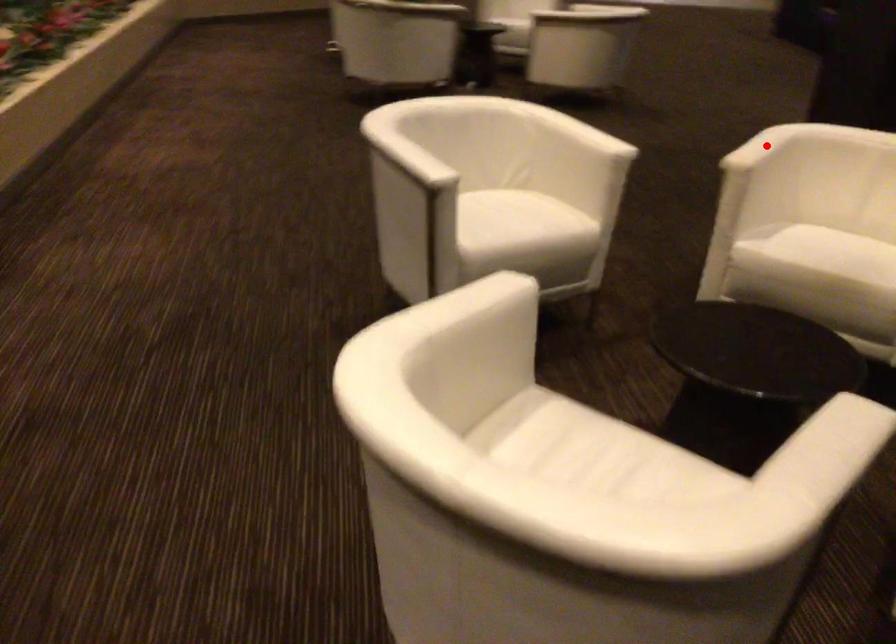
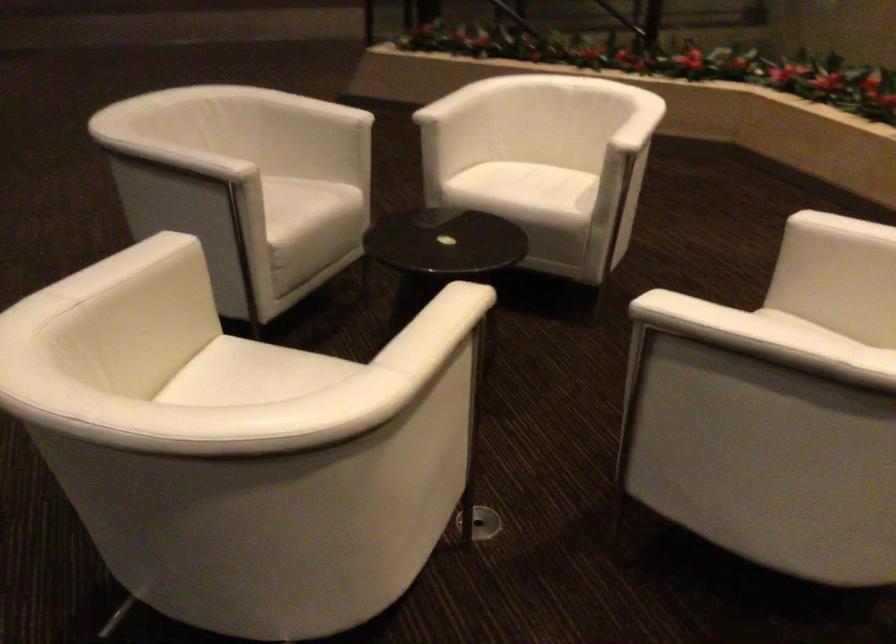
Locate, in the second image, the point that corresponds to the highlighted location in the first image.

(437, 308)